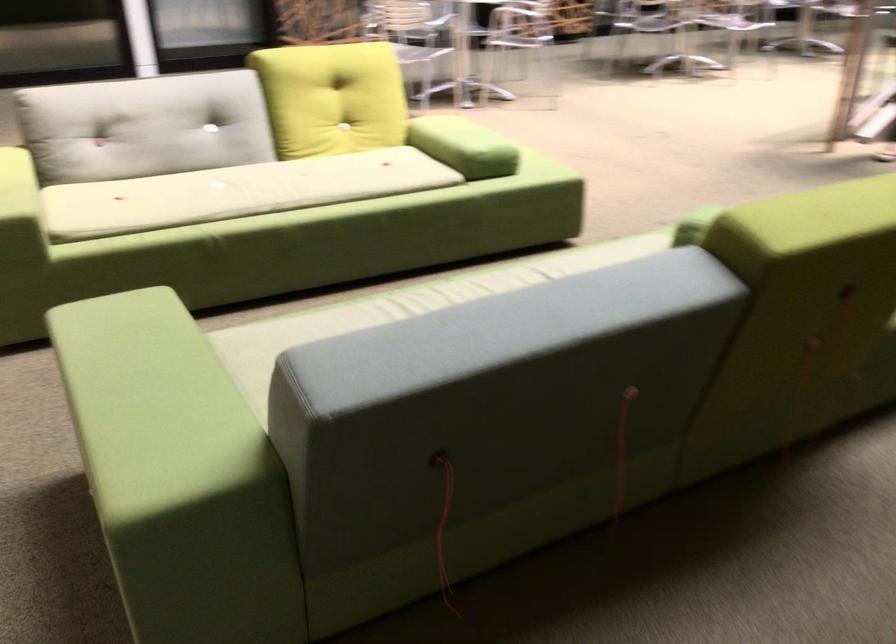
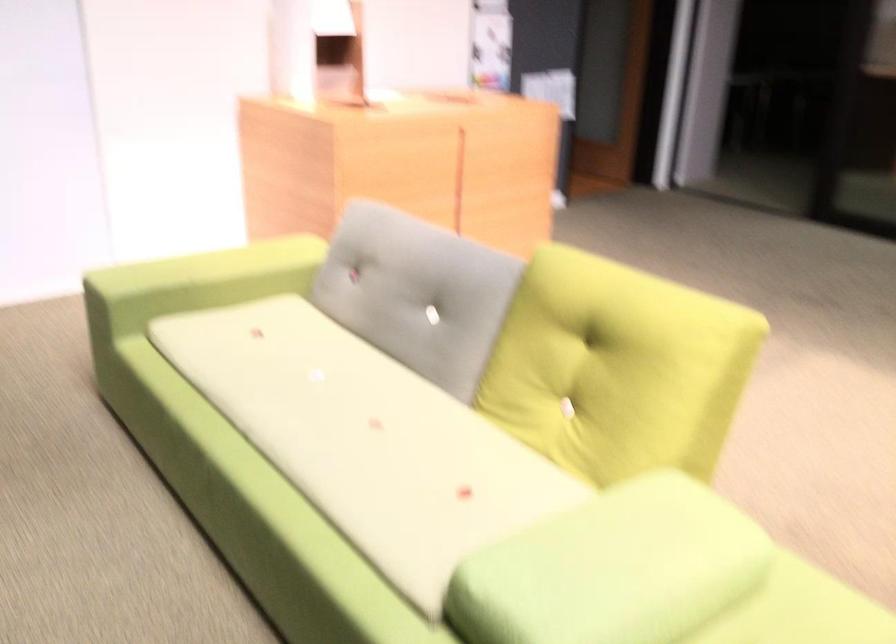
In the second image, find the point that corresponds to [485,127] in the first image.

(613, 569)